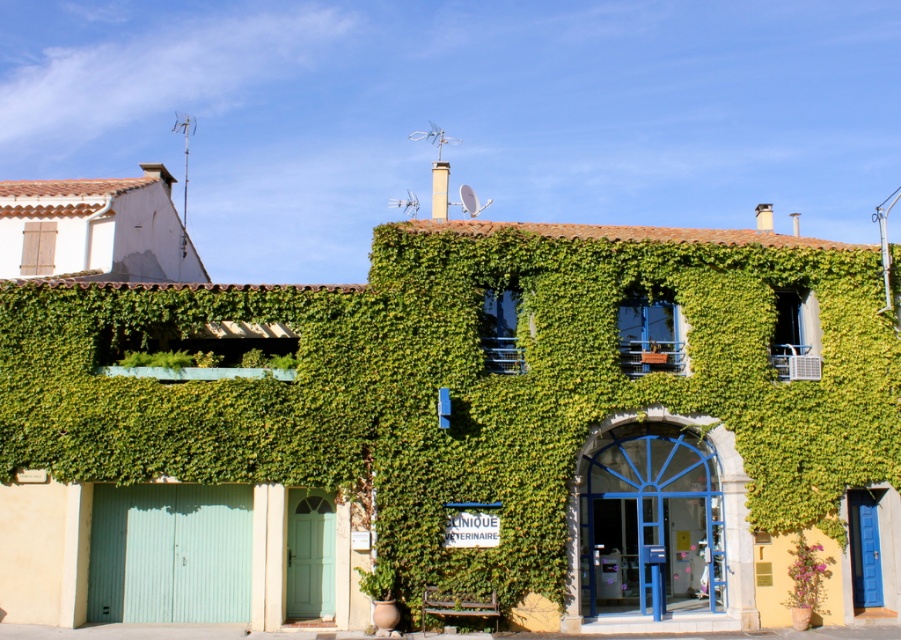
Based on the photo, you are standing at the veterinary clinic entrance and want to reach the point marked as point [626,580]. Which direction should you move relative to point [824,563]?

You should move forward towards point [626,580] because it is behind point [824,563], meaning it is in the direction away from the clinic entrance.